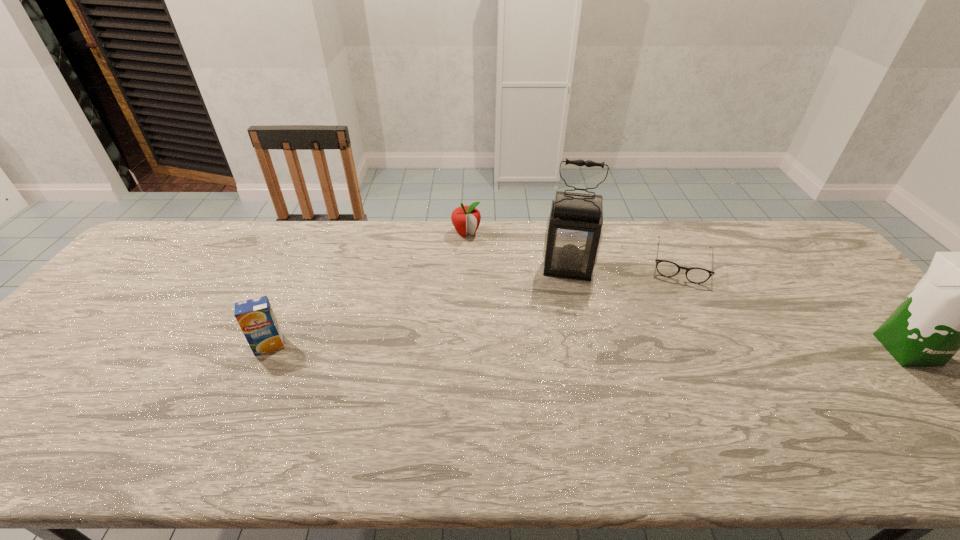
Where is `free space located 0.140m through the lenses of the spectacles`? The image size is (960, 540). free space located 0.140m through the lenses of the spectacles is located at coordinates (677, 316).

Locate an element on the screen. Image resolution: width=960 pixels, height=540 pixels. apple located in the far edge section of the desktop is located at coordinates (466, 219).

This screenshot has height=540, width=960. What are the coordinates of `lantern situated at the far edge` in the screenshot? It's located at (573, 235).

You are a GUI agent. You are given a task and a screenshot of the screen. Output one action in this format:
    pyautogui.click(x=<x>, y=<y>)
    Task: Click on the spectacles situated at the far edge
    The width and height of the screenshot is (960, 540).
    Given the screenshot: What is the action you would take?
    pyautogui.click(x=695, y=275)

Where is `object located at the right edge`? The height and width of the screenshot is (540, 960). object located at the right edge is located at coordinates (959, 303).

Find the location of a particular element. free space at the far edge of the desktop is located at coordinates (721, 253).

In the image, there is a desktop. In order to click on vacant space at the near edge in this screenshot , I will do `click(322, 393)`.

I want to click on vacant space at the left edge, so click(x=140, y=269).

Locate an element on the screen. The image size is (960, 540). vacant area at the right edge of the desktop is located at coordinates (836, 321).

Where is `vacant space at the near right corner of the desktop`? This screenshot has width=960, height=540. vacant space at the near right corner of the desktop is located at coordinates (920, 420).